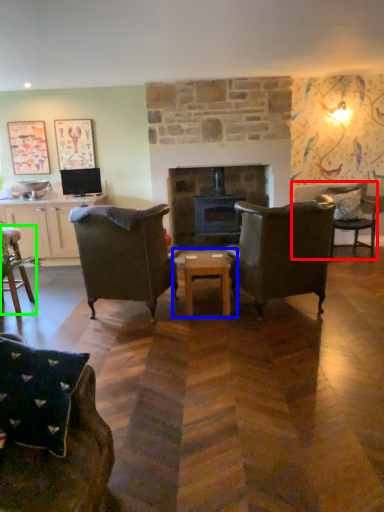
Question: Considering the real-world distances, which object is farthest from chair (highlighted by a red box)? coffee table (highlighted by a blue box) or chair (highlighted by a green box)?

Choices:
 (A) coffee table
 (B) chair

Answer: (B)